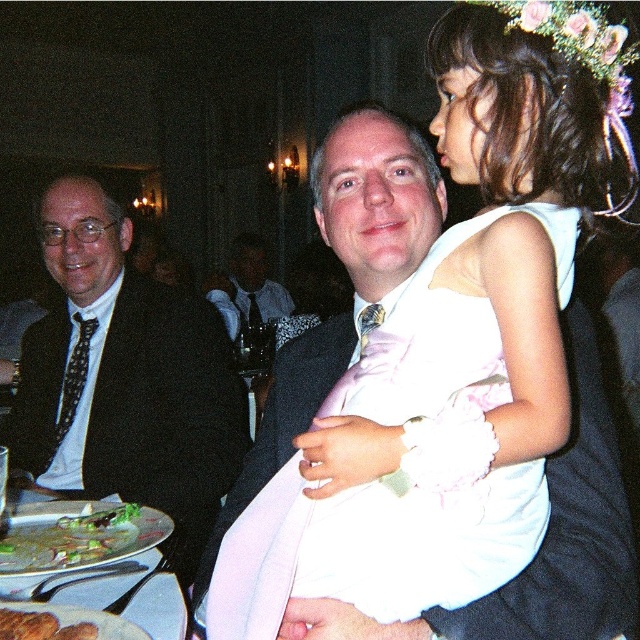
Question: Which object is closer to the camera taking this photo?

Choices:
 (A) black satin suit at left
 (B) brown crumbly bread at lower left
 (C) green leafy vegetables at lower left
 (D) matte black suit at center

Answer: (B)

Question: Which object appears farthest from the camera in this image?

Choices:
 (A) green leafy vegetables at lower left
 (B) white satin dress at center

Answer: (A)

Question: Can you confirm if black satin suit at left is positioned above brown crumbly bread at lower left?

Choices:
 (A) no
 (B) yes

Answer: (B)

Question: Which of the following is the closest to the observer?

Choices:
 (A) white satin dress at center
 (B) matte black suit at center
 (C) brown crumbly bread at lower left

Answer: (A)

Question: Is metallic silver plate at lower left smaller than matte black suit at center?

Choices:
 (A) no
 (B) yes

Answer: (B)

Question: Does green leafy vegetables at lower left have a greater width compared to matte black suit at center?

Choices:
 (A) yes
 (B) no

Answer: (B)